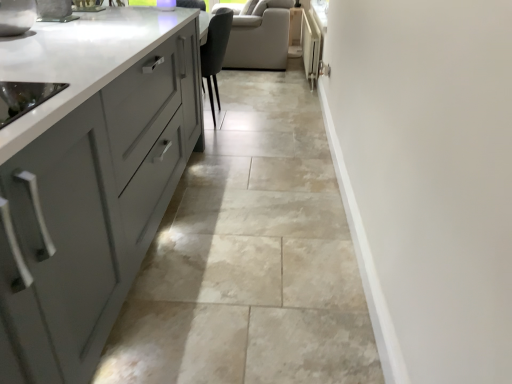
What do you see at coordinates (310, 47) in the screenshot? I see `white glossy radiator at upper right` at bounding box center [310, 47].

Identify the location of white glossy radiator at upper right. (310, 47).

Identify the location of natural stone floor at center. The height and width of the screenshot is (384, 512). (250, 257).

The height and width of the screenshot is (384, 512). What do you see at coordinates (250, 257) in the screenshot?
I see `natural stone floor at center` at bounding box center [250, 257].

This screenshot has height=384, width=512. I want to click on white glossy radiator at upper right, so click(310, 47).

Based on the photo, between natural stone floor at center and white glossy radiator at upper right, which one appears on the right side from the viewer's perspective?

white glossy radiator at upper right.

Considering the positions of objects natural stone floor at center and white glossy radiator at upper right in the image provided, who is in front, natural stone floor at center or white glossy radiator at upper right?

natural stone floor at center is in front.

Considering the positions of points (172, 309) and (319, 58), is point (172, 309) farther from camera compared to point (319, 58)?

No.

From the image's perspective, is natural stone floor at center above white glossy radiator at upper right?

Incorrect, from the image's perspective, natural stone floor at center is lower than white glossy radiator at upper right.

Consider the image. From a real-world perspective, is natural stone floor at center beneath white glossy radiator at upper right?

Yes.

Which of these two, natural stone floor at center or white glossy radiator at upper right, is wider?

natural stone floor at center.

From the picture: Is natural stone floor at center shorter than white glossy radiator at upper right?

Correct, natural stone floor at center is not as tall as white glossy radiator at upper right.

Can you confirm if natural stone floor at center is smaller than white glossy radiator at upper right?

Incorrect, natural stone floor at center is not smaller in size than white glossy radiator at upper right.

Can we say natural stone floor at center lies outside white glossy radiator at upper right?

natural stone floor at center is positioned outside white glossy radiator at upper right.

Consider the image. Is natural stone floor at center far away from white glossy radiator at upper right?

Absolutely, natural stone floor at center is distant from white glossy radiator at upper right.

Is natural stone floor at center positioned with its back to white glossy radiator at upper right?

That's not correct — natural stone floor at center is not looking away from white glossy radiator at upper right.

How different are the orientations of natural stone floor at center and white glossy radiator at upper right in degrees?

The facing directions of natural stone floor at center and white glossy radiator at upper right are 88.3 degrees apart.

Image resolution: width=512 pixels, height=384 pixels. In order to click on appliance lying above the natural stone floor at center (from the image's perspective) in this screenshot , I will do `click(310, 47)`.

Between white glossy radiator at upper right and natural stone floor at center, which one appears on the left side from the viewer's perspective?

natural stone floor at center is more to the left.

Which is behind, white glossy radiator at upper right or natural stone floor at center?

white glossy radiator at upper right is more distant.

Between point (306, 40) and point (234, 278), which one is positioned in front?

The point (234, 278) is closer.

From the image's perspective, which is below, white glossy radiator at upper right or natural stone floor at center?

natural stone floor at center is shown below in the image.

From a real-world perspective, between white glossy radiator at upper right and natural stone floor at center, who is vertically lower?

natural stone floor at center is physically lower.

Does white glossy radiator at upper right have a lesser width compared to natural stone floor at center?

Indeed, white glossy radiator at upper right has a lesser width compared to natural stone floor at center.

Is white glossy radiator at upper right taller or shorter than natural stone floor at center?

In the image, white glossy radiator at upper right appears to be taller than natural stone floor at center.

Can you confirm if white glossy radiator at upper right is bigger than natural stone floor at center?

Incorrect, white glossy radiator at upper right is not larger than natural stone floor at center.

Is natural stone floor at center inside white glossy radiator at upper right?

That's incorrect, natural stone floor at center is not inside white glossy radiator at upper right.

From the picture: Is white glossy radiator at upper right far away from natural stone floor at center?

white glossy radiator at upper right is positioned a significant distance from natural stone floor at center.

Could you tell me if white glossy radiator at upper right is facing natural stone floor at center?

No, white glossy radiator at upper right is not oriented towards natural stone floor at center.

What's the angular difference between white glossy radiator at upper right and natural stone floor at center's facing directions?

white glossy radiator at upper right and natural stone floor at center are facing 88.3 degrees away from each other.

How distant is white glossy radiator at upper right from natural stone floor at center?

white glossy radiator at upper right and natural stone floor at center are 1.94 meters apart.

You are a GUI agent. You are given a task and a screenshot of the screen. Output one action in this format:
    pyautogui.click(x=<x>, y=<y>)
    Task: Click on the granite below the white glossy radiator at upper right (from a real-world perspective)
    
    Given the screenshot: What is the action you would take?
    pyautogui.click(x=250, y=257)

This screenshot has width=512, height=384. I want to click on appliance behind the natural stone floor at center, so tap(310, 47).

The width and height of the screenshot is (512, 384). Identify the location of granite in front of the white glossy radiator at upper right. (250, 257).